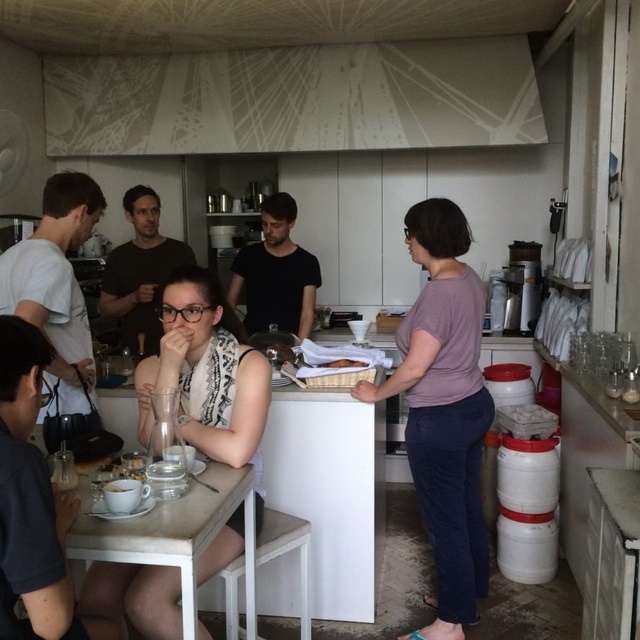
Is purple matte shirt at center below white t-shirt at left?

Indeed, purple matte shirt at center is positioned under white t-shirt at left.

Can you confirm if purple matte shirt at center is smaller than white t-shirt at left?

Actually, purple matte shirt at center might be larger than white t-shirt at left.

Is point (445, 604) closer to camera compared to point (49, 365)?

No, (445, 604) is further to viewer.

Where is `purple matte shirt at center`? The width and height of the screenshot is (640, 640). purple matte shirt at center is located at coordinates (444, 410).

Which is in front, point (93, 518) or point (296, 211)?

Point (93, 518) is in front.

What are the coordinates of `white wooden table at lower left` in the screenshot? It's located at (173, 534).

Is point (54, 179) closer to viewer compared to point (346, 362)?

That is True.

Based on the photo, which is more to the left, white t-shirt at left or matte silver tray at center?

white t-shirt at left

Who is more forward, (92,371) or (340,360)?

Point (92,371) is in front.

Where is `white t-shirt at left`? Image resolution: width=640 pixels, height=640 pixels. white t-shirt at left is located at coordinates (56, 289).